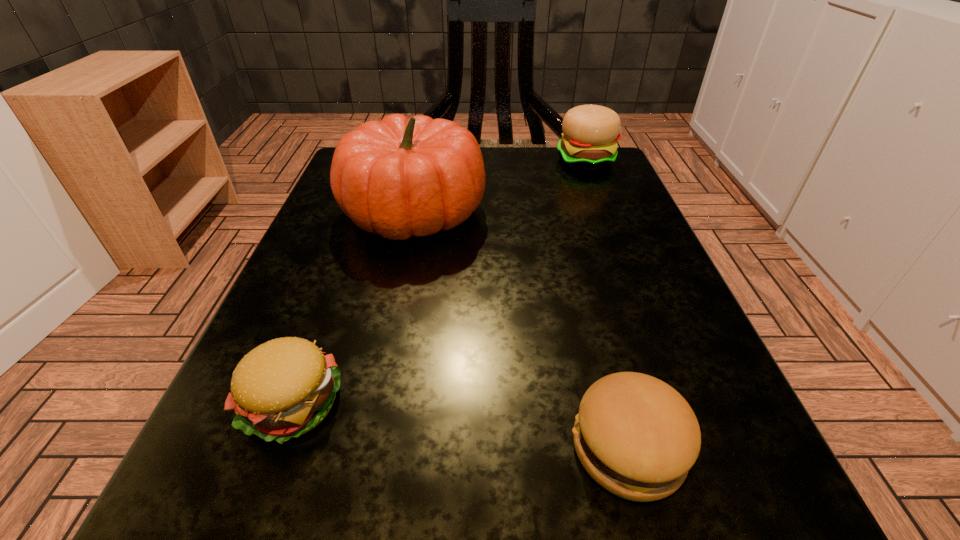
Where is `vacant area that lies between the tallest object and the leftmost hamburger`? The image size is (960, 540). vacant area that lies between the tallest object and the leftmost hamburger is located at coordinates (353, 309).

The width and height of the screenshot is (960, 540). I want to click on free spot between the tallest hamburger and the leftmost hamburger, so click(x=440, y=282).

Image resolution: width=960 pixels, height=540 pixels. I want to click on vacant space in between the leftmost hamburger and the pumpkin, so click(353, 309).

You are a GUI agent. You are given a task and a screenshot of the screen. Output one action in this format:
    pyautogui.click(x=<x>, y=<y>)
    Task: Click on the object that stands as the third closest to the third nearest object
    The width and height of the screenshot is (960, 540).
    Given the screenshot: What is the action you would take?
    pyautogui.click(x=637, y=437)

Where is `object that is the closest to the leftmost hamburger`? This screenshot has width=960, height=540. object that is the closest to the leftmost hamburger is located at coordinates (399, 177).

Choose which hamburger is the nearest neighbor to the leftmost hamburger. Please provide its 2D coordinates. Your answer should be formatted as a tuple, i.e. [(x, y)], where the tuple contains the x and y coordinates of a point satisfying the conditions above.

[(637, 437)]

Identify which hamburger is located as the nearest to the tallest hamburger. Please provide its 2D coordinates. Your answer should be formatted as a tuple, i.e. [(x, y)], where the tuple contains the x and y coordinates of a point satisfying the conditions above.

[(637, 437)]

The height and width of the screenshot is (540, 960). Identify the location of vacant space that satisfies the following two spatial constraints: 1. on the back side of the second tallest object; 2. on the left side of the leftmost hamburger. (383, 160).